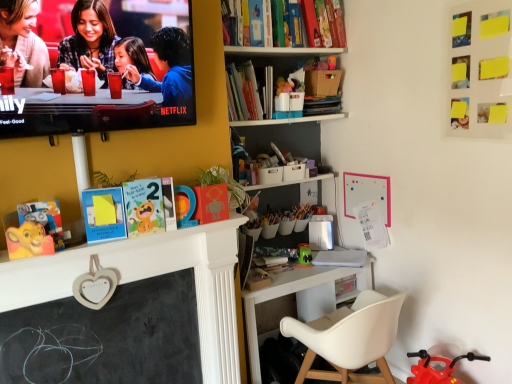
Locate an element on the screen. vacant area on the back side of green matte toy at center is located at coordinates (308, 253).